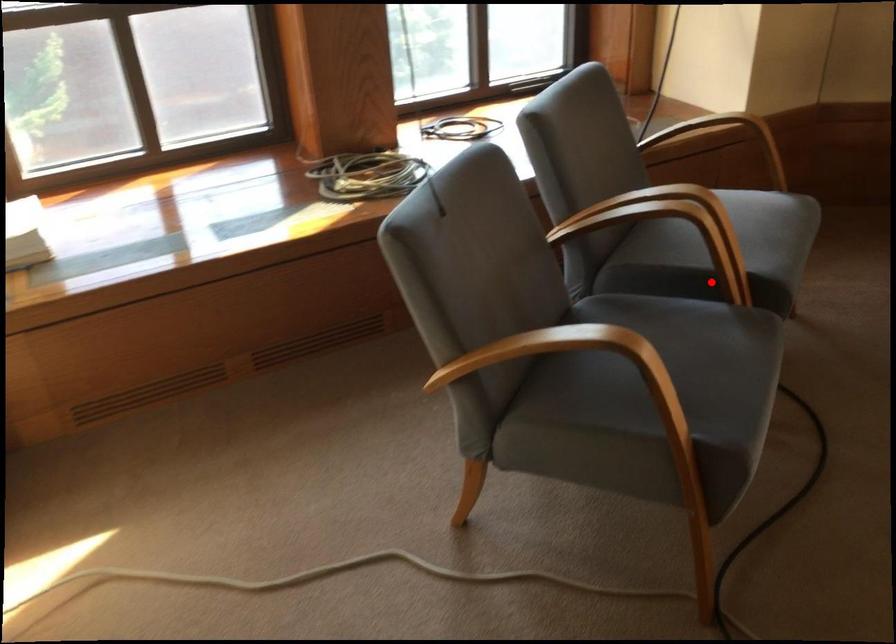
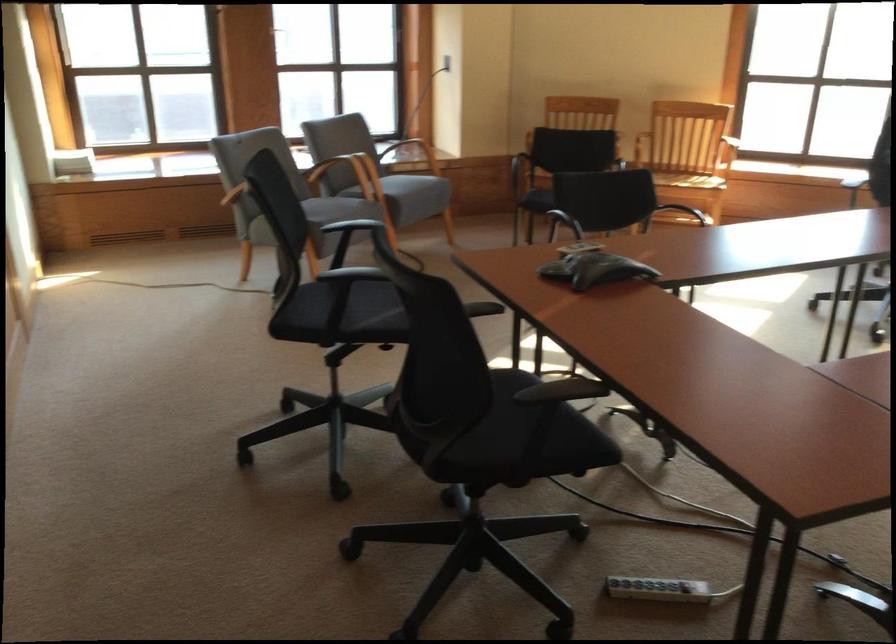
Question: I am providing you with two images of the same scene from different viewpoints. Given a red point in image1, look at the same physical point in image2. Is it:

Choices:
 (A) Closer to the viewpoint
 (B) Farther from the viewpoint

Answer: (B)